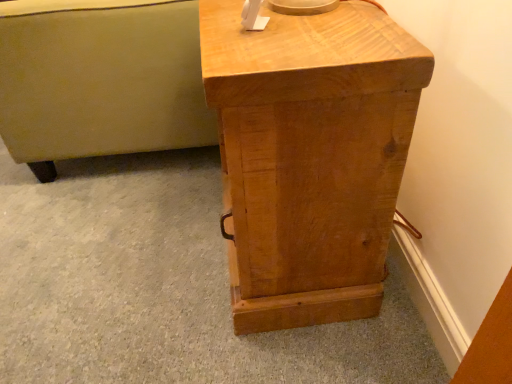
Locate an element on the screen. The width and height of the screenshot is (512, 384). vacant region to the left of light brown wood nightstand at center is located at coordinates (145, 252).